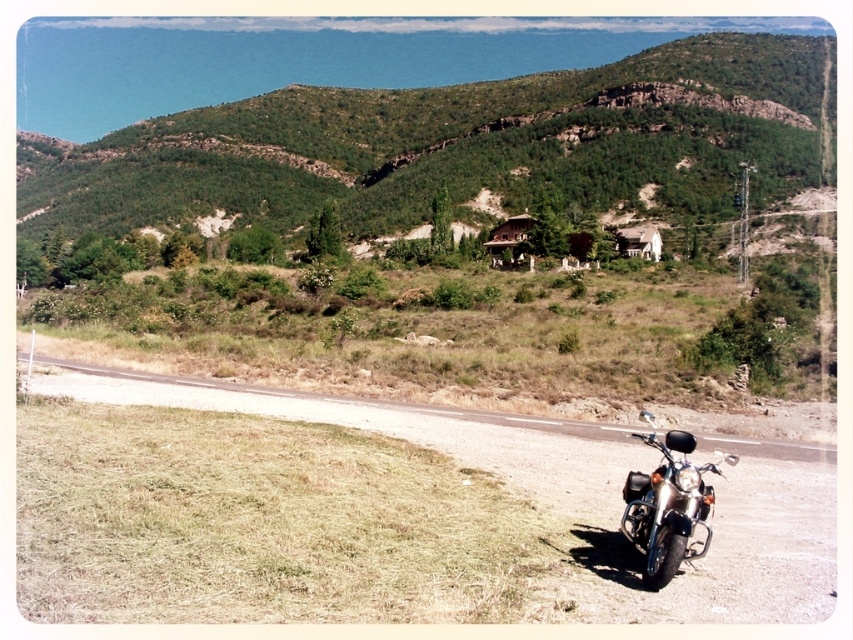
Between green forested mountain at upper center and shiny chrome motorcycle at lower right, which one appears on the right side from the viewer's perspective?

shiny chrome motorcycle at lower right is more to the right.

Does green forested mountain at upper center have a smaller size compared to shiny chrome motorcycle at lower right?

No.

Is point (590, 180) closer to viewer compared to point (645, 515)?

That is False.

Find the location of `green forested mountain at upper center`. green forested mountain at upper center is located at coordinates 444,140.

Is gravel road at lower right bigger than white wooden hut at center?

Yes.

Between gravel road at lower right and white wooden hut at center, which one is positioned lower?

Positioned lower is gravel road at lower right.

Identify the location of gravel road at lower right. (582, 496).

Who is positioned more to the right, green forested mountain at upper center or gravel road at lower right?

Positioned to the right is gravel road at lower right.

Which is behind, point (433, 182) or point (49, 371)?

Point (433, 182)

Measure the distance between point [335,186] and camera.

Point [335,186] is 319.53 meters away from camera.

You are a GUI agent. You are given a task and a screenshot of the screen. Output one action in this format:
    pyautogui.click(x=<x>, y=<y>)
    Task: Click on the green forested mountain at upper center
    
    Given the screenshot: What is the action you would take?
    pyautogui.click(x=444, y=140)